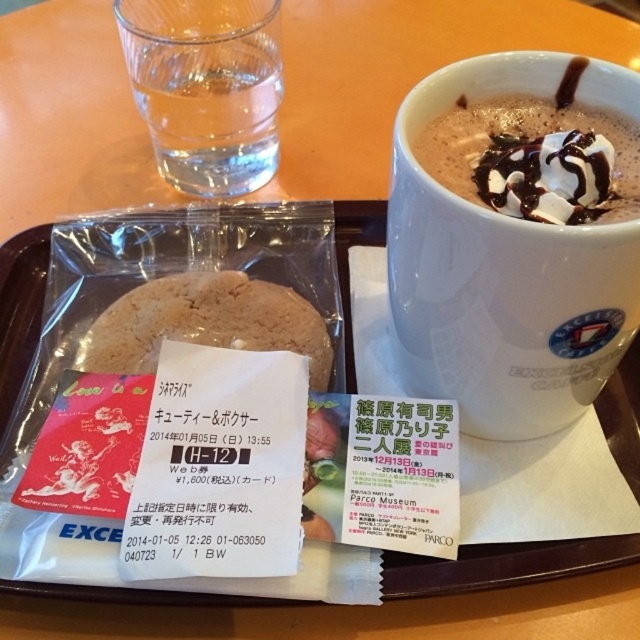
Is biscuit at center to the right of chocolate frothy beverage at upper right from the viewer's perspective?

No, biscuit at center is not to the right of chocolate frothy beverage at upper right.

Does point (134, 289) come in front of point (577, 109)?

No.

Locate an element on the screen. Image resolution: width=640 pixels, height=640 pixels. biscuit at center is located at coordinates (205, 323).

Is the position of white glossy mug at upper center more distant than that of chocolate frothy beverage at upper right?

No, white glossy mug at upper center is in front of chocolate frothy beverage at upper right.

Is white glossy mug at upper center below chocolate frothy beverage at upper right?

Yes.

Does point (400, 262) come closer to viewer compared to point (600, 116)?

Yes, point (400, 262) is in front of point (600, 116).

I want to click on white glossy mug at upper center, so click(x=499, y=275).

Can you confirm if clear glass water at upper left is positioned below biscuit at center?

No.

Describe the element at coordinates (205, 88) in the screenshot. This screenshot has height=640, width=640. I see `clear glass water at upper left` at that location.

Identify the location of clear glass water at upper left. The height and width of the screenshot is (640, 640). (205, 88).